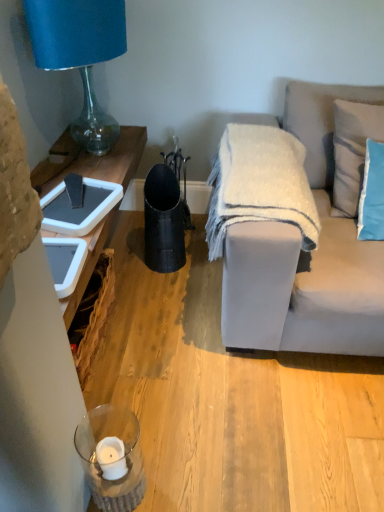
Question: Relative to blue fabric pillow at upper right, marked as the second pillow in a top-to-bottom arrangement, is light gray fabric couch at right in front or behind?

Choices:
 (A) behind
 (B) front

Answer: (B)

Question: Choose the correct answer: Is light gray fabric couch at right inside blue fabric pillow at upper right, the 1th pillow positioned from the bottom, or outside it?

Choices:
 (A) inside
 (B) outside

Answer: (B)

Question: Which object is positioned closest to the light gray fabric pillow at upper right, marked as the 1th pillow in a top-to-bottom arrangement?

Choices:
 (A) blue glass lamp at upper left
 (B) light gray fabric couch at right
 (C) white fuzzy blanket at center
 (D) blue fabric pillow at upper right, marked as the second pillow in a top-to-bottom arrangement

Answer: (D)

Question: Estimate the real-world distances between objects in this image. Which object is closer to the blue fabric pillow at upper right, marked as the second pillow in a top-to-bottom arrangement?

Choices:
 (A) light gray fabric couch at right
 (B) light gray fabric pillow at upper right, marked as the 1th pillow in a top-to-bottom arrangement
 (C) blue glass lamp at upper left
 (D) white fuzzy blanket at center

Answer: (B)